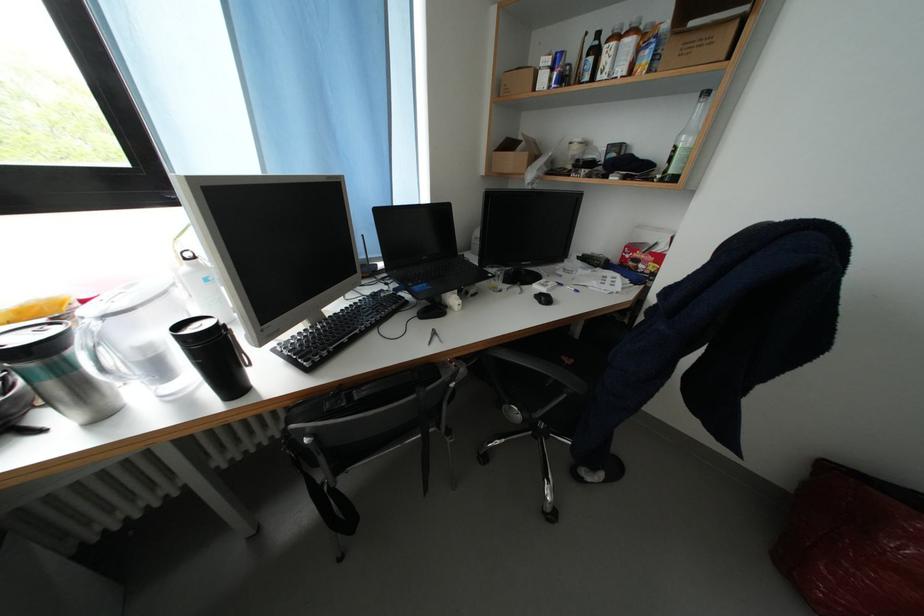
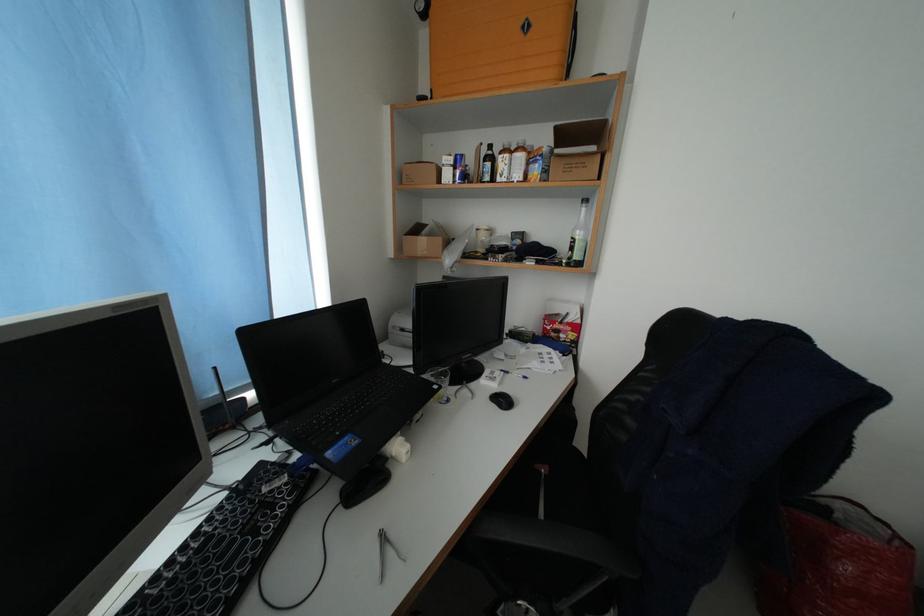
Find the pixel in the second image that matches point 497,280 in the first image.

(444, 392)